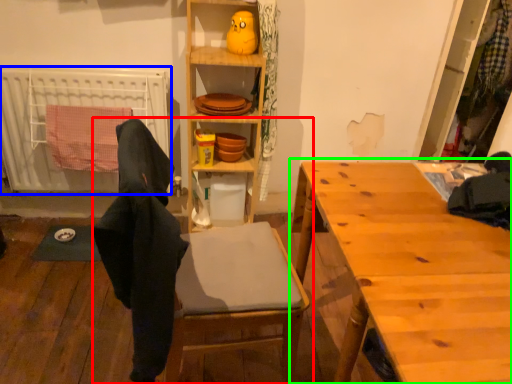
Question: Based on their relative distances, which object is nearer to chair (highlighted by a red box)? Choose from radiator (highlighted by a blue box) and table (highlighted by a green box).

Choices:
 (A) radiator
 (B) table

Answer: (B)